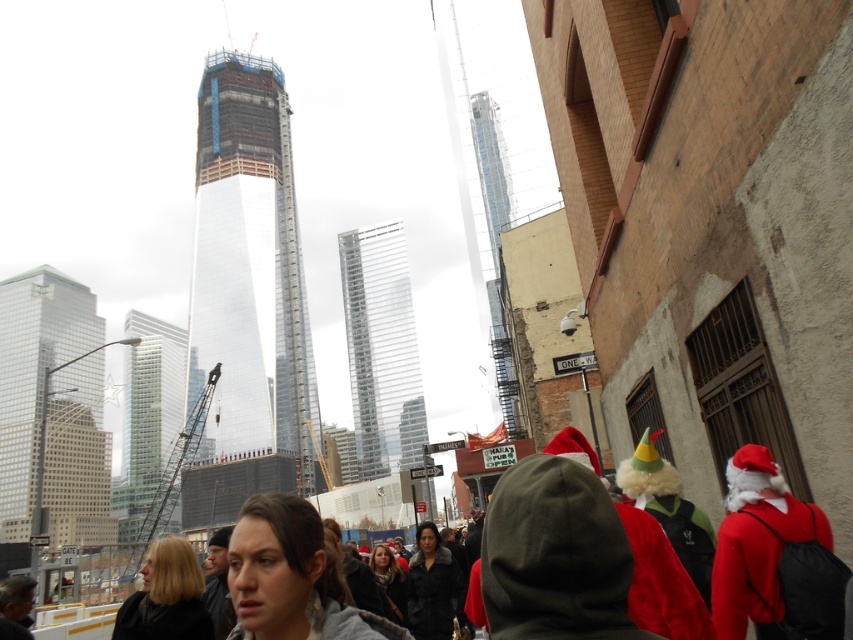
Question: Is red velvet santa hat at center-right closer to camera compared to velvet red santa hat at right?

Choices:
 (A) yes
 (B) no

Answer: (A)

Question: Which object is closer to the camera taking this photo?

Choices:
 (A) red velvet santa hat at center-right
 (B) velvet red santa hat at right

Answer: (A)

Question: In this image, where is red velvet santa hat at center-right located relative to velvet red santa hat at right?

Choices:
 (A) below
 (B) above

Answer: (B)

Question: Which point appears farthest from the camera in this image?

Choices:
 (A) 666,508
 (B) 773,570

Answer: (A)

Question: Which object is farther from the camera taking this photo?

Choices:
 (A) red velvet santa hat at center-right
 (B) velvet red santa hat at right

Answer: (B)

Question: Is red velvet santa hat at center-right further to the viewer compared to velvet red santa hat at right?

Choices:
 (A) yes
 (B) no

Answer: (B)